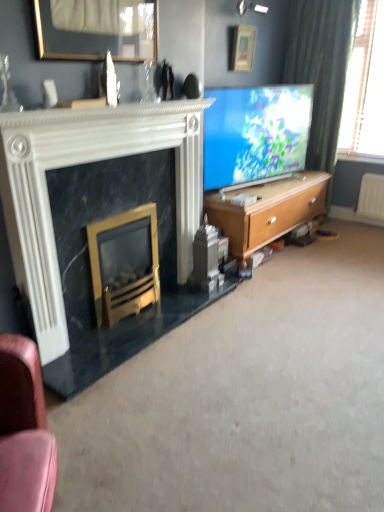
The width and height of the screenshot is (384, 512). Identify the location of free space on the front side of wooden cabinet at right. (278, 290).